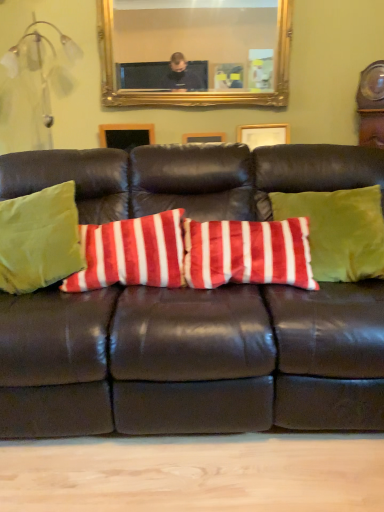
Question: Does green velvet pillow at left, the third pillow viewed from the right, appear on the left side of gold-framed mirror at upper center?

Choices:
 (A) yes
 (B) no

Answer: (A)

Question: Can gold-framed mirror at upper center be found inside green velvet pillow at left, the 1th pillow in the left-to-right sequence?

Choices:
 (A) no
 (B) yes

Answer: (A)

Question: Is green velvet pillow at left, the third pillow viewed from the right, positioned with its back to gold-framed mirror at upper center?

Choices:
 (A) yes
 (B) no

Answer: (B)

Question: Is green velvet pillow at left, the 1th pillow in the left-to-right sequence, far away from gold-framed mirror at upper center?

Choices:
 (A) no
 (B) yes

Answer: (B)

Question: Is green velvet pillow at left, the 1th pillow in the left-to-right sequence, in contact with gold-framed mirror at upper center?

Choices:
 (A) yes
 (B) no

Answer: (B)

Question: Can you confirm if green velvet pillow at left, the 1th pillow in the left-to-right sequence, is positioned to the right of gold-framed mirror at upper center?

Choices:
 (A) yes
 (B) no

Answer: (B)

Question: Considering the relative sizes of gold-framed mirror at upper center and green velvet pillow at left, the third pillow viewed from the right, in the image provided, is gold-framed mirror at upper center thinner than green velvet pillow at left, the third pillow viewed from the right,?

Choices:
 (A) yes
 (B) no

Answer: (A)

Question: Is the depth of gold-framed mirror at upper center less than that of green velvet pillow at left, the 1th pillow in the left-to-right sequence?

Choices:
 (A) yes
 (B) no

Answer: (B)

Question: Can you confirm if gold-framed mirror at upper center is positioned to the left of green velvet pillow at left, the 1th pillow in the left-to-right sequence?

Choices:
 (A) no
 (B) yes

Answer: (A)

Question: Is gold-framed mirror at upper center smaller than green velvet pillow at left, the third pillow viewed from the right?

Choices:
 (A) yes
 (B) no

Answer: (A)

Question: Is gold-framed mirror at upper center directly adjacent to green velvet pillow at left, the third pillow viewed from the right?

Choices:
 (A) yes
 (B) no

Answer: (B)

Question: Is gold-framed mirror at upper center wider than green velvet pillow at left, the third pillow viewed from the right?

Choices:
 (A) yes
 (B) no

Answer: (B)

Question: Does velvety red and white striped pillow at center, the second pillow in the right-to-left sequence, have a greater width compared to velvet green pillow at center, which is counted as the 3th pillow, starting from the left?

Choices:
 (A) no
 (B) yes

Answer: (B)